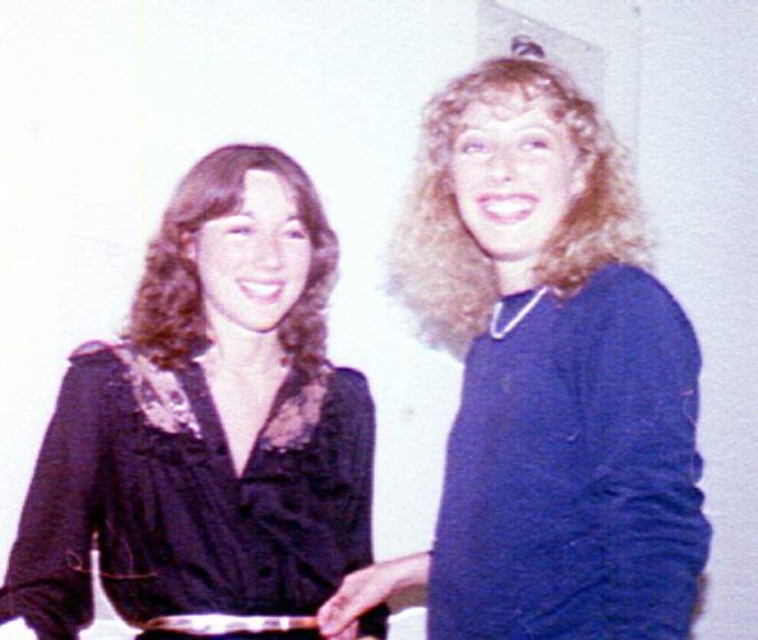
You are a tailor who needs to hang the blue woolen sweater at right and the black satin blouse at left on a rack. Which one should you place higher on the rack to ensure both garments are fully visible?

The blue woolen sweater at right is much taller than the black satin blouse at left, so placing the sweater higher on the rack will allow both garments to be fully visible without overlapping.

You are standing in a room and see two people holding a small object together. You want to pick up a pen from the floor near you and place it exactly at the point marked as point [246,390]. If you can reach 3.1 feet, can you place the pen there without moving?

The point [246,390] is 4.62 feet away from you, which is beyond your reach of 3.1 feet. You cannot place the pen there without moving.